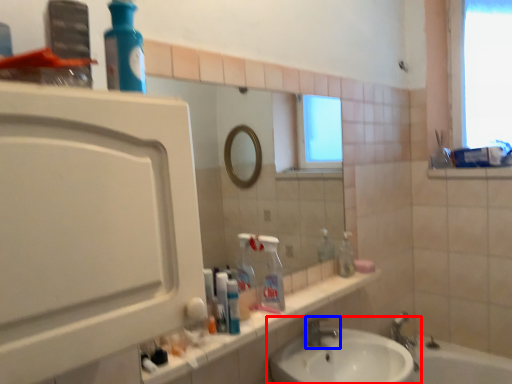
Question: Which point is further to the camera, sink (highlighted by a red box) or tap (highlighted by a blue box)?

Choices:
 (A) sink
 (B) tap

Answer: (B)